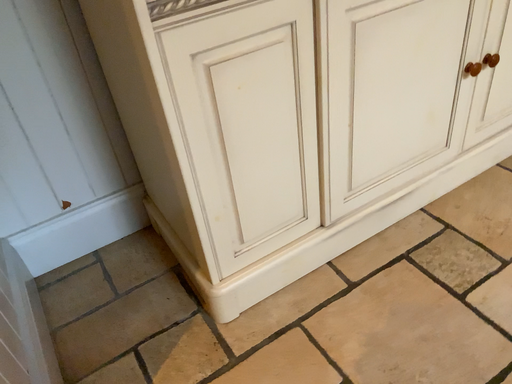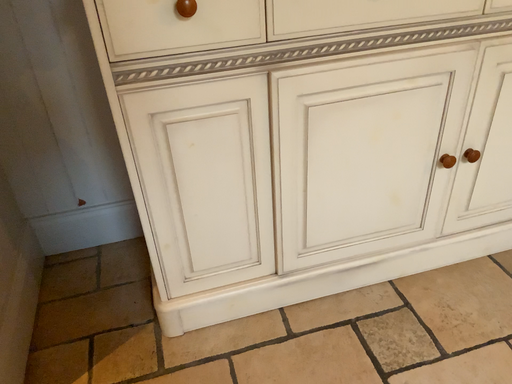
Question: Which way did the camera rotate in the video?

Choices:
 (A) rotated left
 (B) rotated right

Answer: (A)